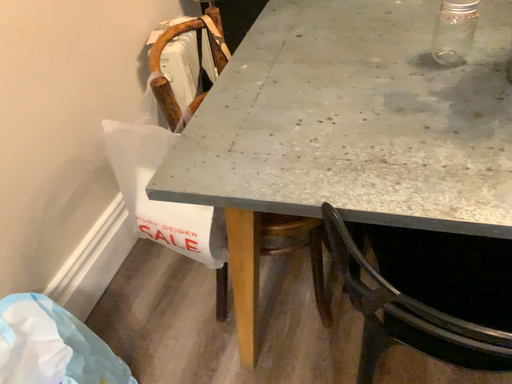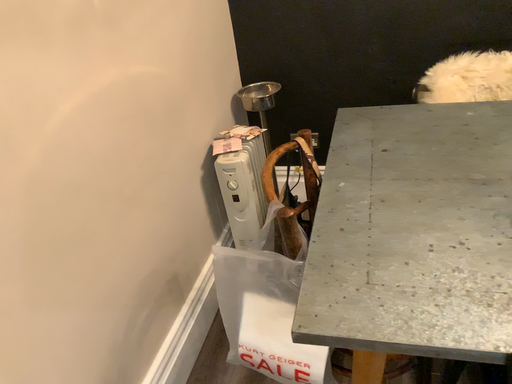
Question: Which way did the camera rotate in the video?

Choices:
 (A) rotated upward
 (B) rotated downward

Answer: (A)